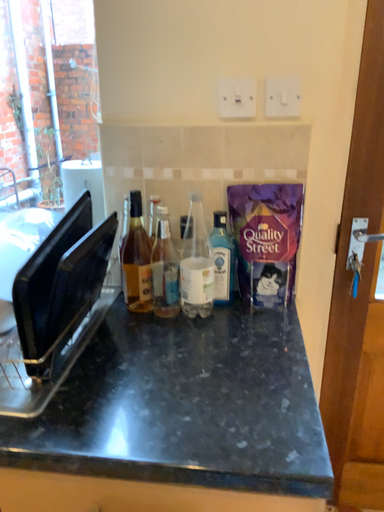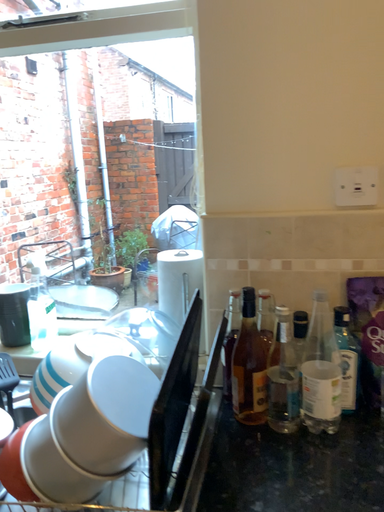
Question: Which way did the camera rotate in the video?

Choices:
 (A) rotated downward
 (B) rotated upward

Answer: (B)